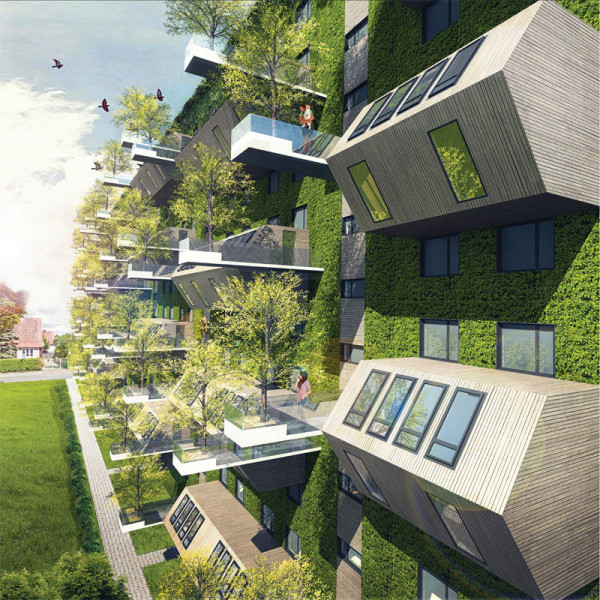
Find the location of a particular element. This screenshot has width=600, height=600. window is located at coordinates (443, 330).